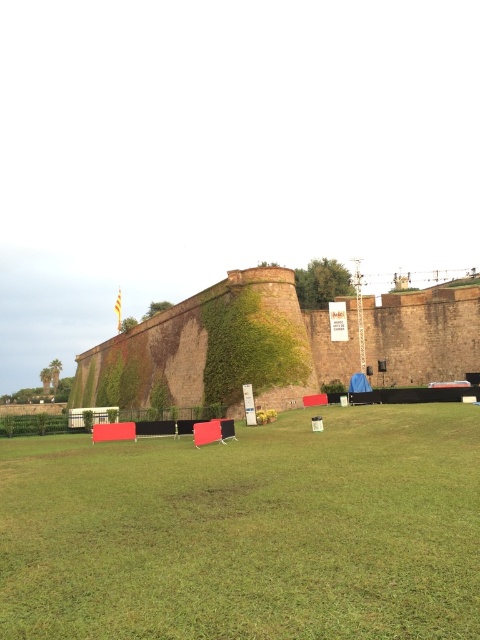
This screenshot has width=480, height=640. Describe the element at coordinates (249, 531) in the screenshot. I see `green grass at center` at that location.

Locate an element on the screen. green grass at center is located at coordinates (249, 531).

Between green grass at center and brick wall at center, which one is positioned higher?

brick wall at center is above.

Does green grass at center appear over brick wall at center?

No.

The width and height of the screenshot is (480, 640). I want to click on green grass at center, so click(x=249, y=531).

Image resolution: width=480 pixels, height=640 pixels. I want to click on green grass at center, so click(x=249, y=531).

Which is more to the right, brick wall at center or green leafy hedge at lower left?

brick wall at center is more to the right.

Who is taller, brick wall at center or green leafy hedge at lower left?

Standing taller between the two is brick wall at center.

Measure the distance between point (478, 358) and camera.

A distance of 75.84 meters exists between point (478, 358) and camera.

This screenshot has width=480, height=640. In order to click on brick wall at center in this screenshot , I will do tap(210, 348).